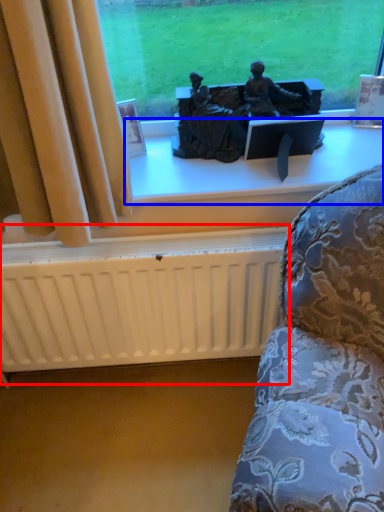
Question: Among these objects, which one is farthest to the camera, radiator (highlighted by a red box) or window sill (highlighted by a blue box)?

Choices:
 (A) radiator
 (B) window sill

Answer: (B)